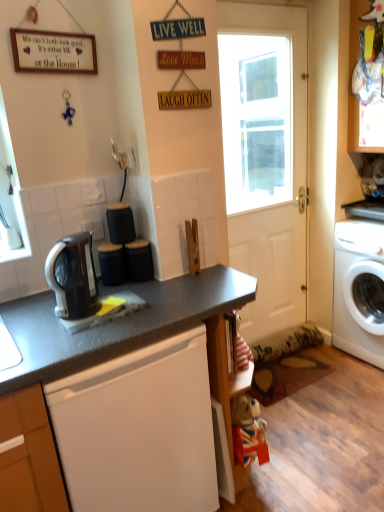
This screenshot has height=512, width=384. I want to click on white glossy washing machine at right, so click(x=355, y=290).

What do you see at coordinates (139, 260) in the screenshot? I see `black fabric ottoman at center, the 2th appliance from the left` at bounding box center [139, 260].

What is the approximate height of black glossy coffee maker at left?

black glossy coffee maker at left is 10.55 inches tall.

Where is `black glossy coffee maker at left`? The width and height of the screenshot is (384, 512). black glossy coffee maker at left is located at coordinates pyautogui.click(x=73, y=277).

Find the location of a particular element. The image size is (384, 512). matte black coffee maker at center, the 1th appliance positioned from the left is located at coordinates (112, 264).

What is the approximate width of white matte door at center?

white matte door at center is 2.43 inches wide.

Locate an element on the screen. The width and height of the screenshot is (384, 512). white glossy washing machine at right is located at coordinates (355, 290).

Does white glossy washing machine at right turn towards white matte door at center?

No, white glossy washing machine at right does not turn towards white matte door at center.

How much distance is there between white glossy washing machine at right and white matte door at center?

white glossy washing machine at right is 5.67 feet from white matte door at center.

From the image's perspective, is white glossy washing machine at right positioned above or below white matte door at center?

white glossy washing machine at right is below white matte door at center.

Are white glossy washing machine at right and white matte door at center beside each other?

No, white glossy washing machine at right is not making contact with white matte door at center.

Can you see white matte door at center touching white glossy washing machine at right?

No, white matte door at center is not in contact with white glossy washing machine at right.

Considering the positions of objects white matte door at center and white glossy washing machine at right in the image provided, who is more to the left, white matte door at center or white glossy washing machine at right?

white matte door at center.

From a real-world perspective, does white matte door at center sit lower than white glossy washing machine at right?

No, from a real-world perspective, white matte door at center is not under white glossy washing machine at right.

Is white matte door at center inside or outside of white glossy washing machine at right?

The correct answer is: outside.

Considering the sizes of black glossy coffee maker at left and white matte door at center in the image, is black glossy coffee maker at left taller or shorter than white matte door at center?

black glossy coffee maker at left is shorter than white matte door at center.

Consider the image. Is black glossy coffee maker at left to the right of white matte door at center from the viewer's perspective?

In fact, black glossy coffee maker at left is to the left of white matte door at center.

From a real-world perspective, which object rests below the other?

In real-world perspective, black glossy coffee maker at left is lower.

Between black glossy coffee maker at left and white matte door at center, which one is positioned in front?

black glossy coffee maker at left.

Between black glossy coffee maker at left and black fabric ottoman at center, the 2th appliance from the left, which one appears on the left side from the viewer's perspective?

From the viewer's perspective, black glossy coffee maker at left appears more on the left side.

Is the surface of black glossy coffee maker at left in direct contact with black fabric ottoman at center, the 2th appliance from the left?

No, black glossy coffee maker at left is not in contact with black fabric ottoman at center, the 2th appliance from the left.

Is black glossy coffee maker at left oriented away from black fabric ottoman at center, the 2th appliance from the left?

No, black glossy coffee maker at left is not facing away from black fabric ottoman at center, the 2th appliance from the left.

From the image's perspective, is black glossy coffee maker at left beneath black fabric ottoman at center, which is the 1th appliance in right-to-left order?

Yes.

From the image's perspective, is white glossy washing machine at right positioned above or below matte black countertop at center?

white glossy washing machine at right is situated higher than matte black countertop at center in the image.

Is white glossy washing machine at right positioned far away from matte black countertop at center?

Yes, white glossy washing machine at right and matte black countertop at center are located far from each other.

Can you confirm if white glossy washing machine at right is thinner than matte black countertop at center?

Correct, the width of white glossy washing machine at right is less than that of matte black countertop at center.

Is point (111, 243) positioned before point (144, 263)?

No, (111, 243) is behind (144, 263).

Consider the image. From a real-world perspective, between matte black coffee maker at center, which is counted as the second appliance, starting from the right, and black fabric ottoman at center, the 2th appliance from the left, who is vertically lower?

In real-world perspective, matte black coffee maker at center, which is counted as the second appliance, starting from the right, is lower.

Looking at this image, could you tell me if matte black coffee maker at center, the 1th appliance positioned from the left, is facing black fabric ottoman at center, which is the 1th appliance in right-to-left order?

No, matte black coffee maker at center, the 1th appliance positioned from the left, is not oriented towards black fabric ottoman at center, which is the 1th appliance in right-to-left order.

Looking at this image, who is bigger, matte black coffee maker at center, which is counted as the second appliance, starting from the right, or black fabric ottoman at center, the 2th appliance from the left?

matte black coffee maker at center, which is counted as the second appliance, starting from the right, is bigger.

Is matte black coffee maker at center, the 1th appliance positioned from the left, at the back of white glossy washing machine at right?

No, white glossy washing machine at right is not facing away from matte black coffee maker at center, the 1th appliance positioned from the left.

Which of these two, white glossy washing machine at right or matte black coffee maker at center, the 1th appliance positioned from the left, is thinner?

matte black coffee maker at center, the 1th appliance positioned from the left, is thinner.

Which is in front, white glossy washing machine at right or matte black coffee maker at center, the 1th appliance positioned from the left?

matte black coffee maker at center, the 1th appliance positioned from the left, is more forward.

Where is `washing machine that appears on the right of white matte door at center`? The image size is (384, 512). washing machine that appears on the right of white matte door at center is located at coordinates (355, 290).

Find the location of `washing machine beneath the white matte door at center (from a real-world perspective)`. washing machine beneath the white matte door at center (from a real-world perspective) is located at coordinates (355, 290).

Estimate the real-world distances between objects in this image. Which object is closer to matte black coffee maker at center, which is counted as the second appliance, starting from the right, black fabric ottoman at center, the 2th appliance from the left, or black glossy coffee maker at left?

The object closer to matte black coffee maker at center, which is counted as the second appliance, starting from the right, is black fabric ottoman at center, the 2th appliance from the left.

From the image, which object appears to be farther from white matte door at center, matte black coffee maker at center, the 1th appliance positioned from the left, or black fabric ottoman at center, which is the 1th appliance in right-to-left order?

matte black coffee maker at center, the 1th appliance positioned from the left, lies further to white matte door at center than the other object.

Based on their spatial positions, is matte black countertop at center or white glossy washing machine at right closer to black glossy coffee maker at left?

matte black countertop at center.

Looking at the image, which one is located closer to matte black coffee maker at center, which is counted as the second appliance, starting from the right, black glossy coffee maker at left or white glossy washing machine at right?

black glossy coffee maker at left lies closer to matte black coffee maker at center, which is counted as the second appliance, starting from the right, than the other object.

Based on their spatial positions, is matte black coffee maker at center, which is counted as the second appliance, starting from the right, or black glossy coffee maker at left closer to white matte door at center?

matte black coffee maker at center, which is counted as the second appliance, starting from the right.

Which object lies further to the anchor point black glossy coffee maker at left, white matte door at center or matte black coffee maker at center, the 1th appliance positioned from the left?

white matte door at center.

Based on their spatial positions, is matte black coffee maker at center, the 1th appliance positioned from the left, or black fabric ottoman at center, which is the 1th appliance in right-to-left order, further from matte black countertop at center?

Among the two, matte black coffee maker at center, the 1th appliance positioned from the left, is located further to matte black countertop at center.

Estimate the real-world distances between objects in this image. Which object is further from white glossy washing machine at right, black glossy coffee maker at left or matte black countertop at center?

The object further to white glossy washing machine at right is black glossy coffee maker at left.

The image size is (384, 512). I want to click on countertop between matte black coffee maker at center, the 1th appliance positioned from the left, and white glossy washing machine at right, so click(113, 328).

At what (x,y) coordinates should I click in order to perform the action: click on countertop situated between black glossy coffee maker at left and white glossy washing machine at right from left to right. Please return your answer as a coordinate pair (x, y). This screenshot has height=512, width=384. Looking at the image, I should click on (113, 328).

The height and width of the screenshot is (512, 384). What are the coordinates of `door between matte black coffee maker at center, which is counted as the second appliance, starting from the right, and white glossy washing machine at right from left to right` in the screenshot? It's located at (266, 157).

This screenshot has width=384, height=512. Find the location of `kitchen appliance between matte black countertop at center and white matte door at center along the z-axis`. kitchen appliance between matte black countertop at center and white matte door at center along the z-axis is located at coordinates (73, 277).